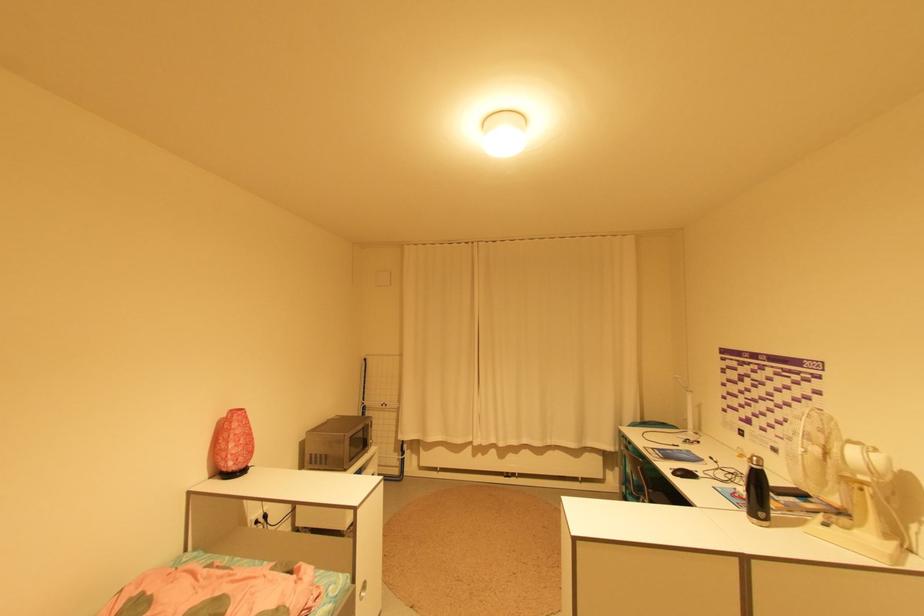
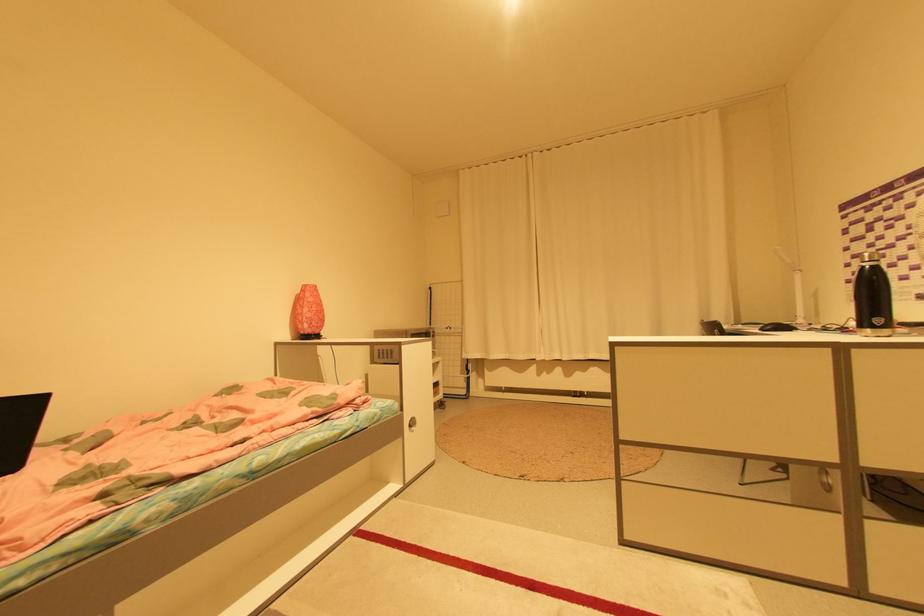
The point at (686, 474) is marked in the first image. Where is the corresponding point in the second image?

(775, 328)